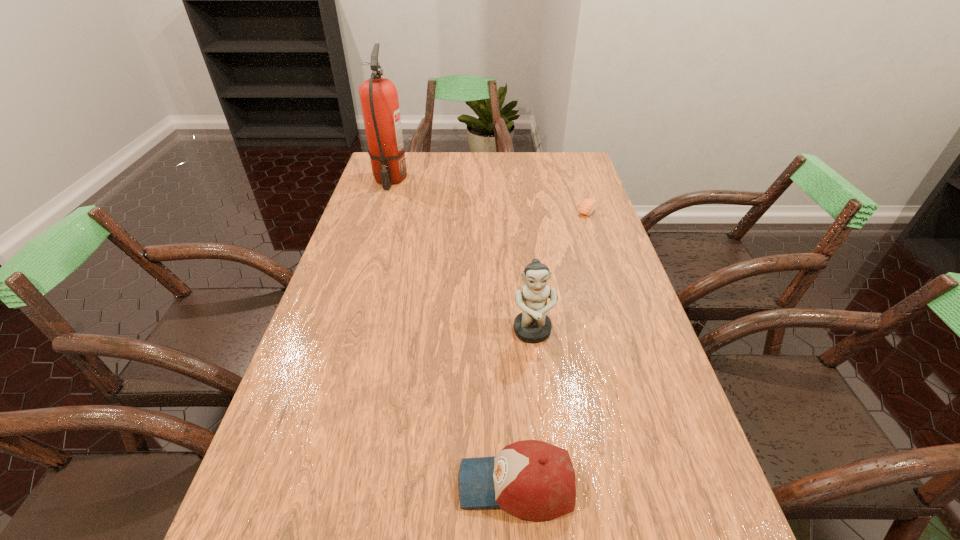
Find the location of a particular element. vacant area situated 0.200m on the front-facing side of the nearest object is located at coordinates (x=346, y=484).

Image resolution: width=960 pixels, height=540 pixels. What are the coordinates of `free space located 0.290m on the front-facing side of the nearest object` in the screenshot? It's located at (296, 484).

Locate an element on the screen. free spot located on the front-facing side of the nearest object is located at coordinates (296, 484).

Where is `free space located on the back of the second farthest object`? The width and height of the screenshot is (960, 540). free space located on the back of the second farthest object is located at coordinates tap(569, 158).

The width and height of the screenshot is (960, 540). I want to click on object present at the far edge, so (379, 98).

Image resolution: width=960 pixels, height=540 pixels. I want to click on object at the left edge, so click(x=379, y=98).

The image size is (960, 540). Find the location of `object that is at the right edge`. object that is at the right edge is located at coordinates (588, 205).

This screenshot has width=960, height=540. I want to click on object at the far left corner, so click(x=379, y=98).

In the image, there is a desktop. Where is `free space at the left edge`? This screenshot has height=540, width=960. free space at the left edge is located at coordinates (252, 491).

Identify the location of vacant space at the right edge of the desktop. (586, 183).